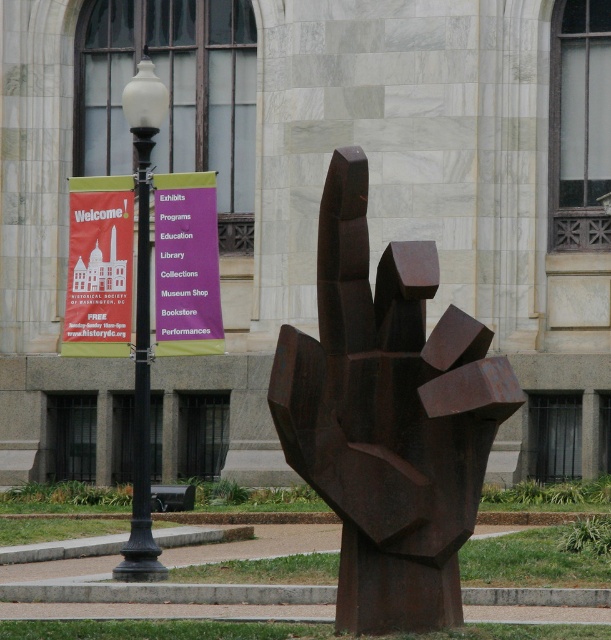
You are a tourist holding a camera and want to take a photo of the purple matte sign at upper center and the black polished lamp post at upper left. Which object will appear wider in the photo?

The black polished lamp post at upper left will appear wider in the photo because its width is greater than the purple matte sign at upper center.

You are planning to take a photo of the rusty metal hand at center and the black polished lamp post at upper left. Which object should you focus on first if you want to capture both in a single frame without moving the camera?

You should focus on the rusty metal hand at center first because it occupies less space than the black polished lamp post at upper left, allowing you to frame both objects effectively without needing to adjust the camera position.

You are standing in the public space and want to find the Historical Society of Washington, D.C. The sculpture of a hand is in front of you, and there is a lamppost with banners nearby. Where is the purple matte sign at upper center located relative to the sculpture and the lamppost?

The purple matte sign at upper center is located at coordinates point (186,264). Since the sculpture is in the foreground and the lamppost is in the midground, the sign is positioned above and to the left of both the sculpture and the lamppost.